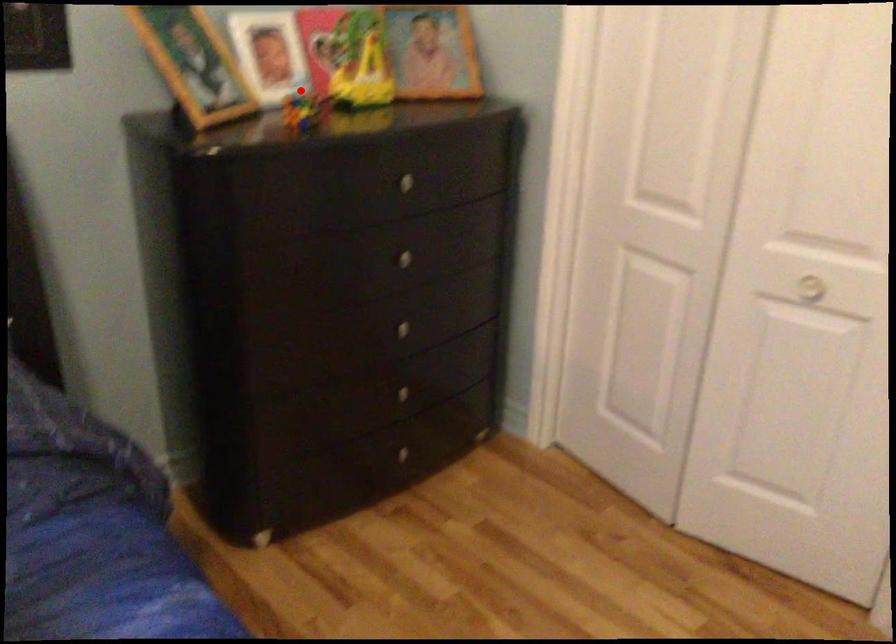
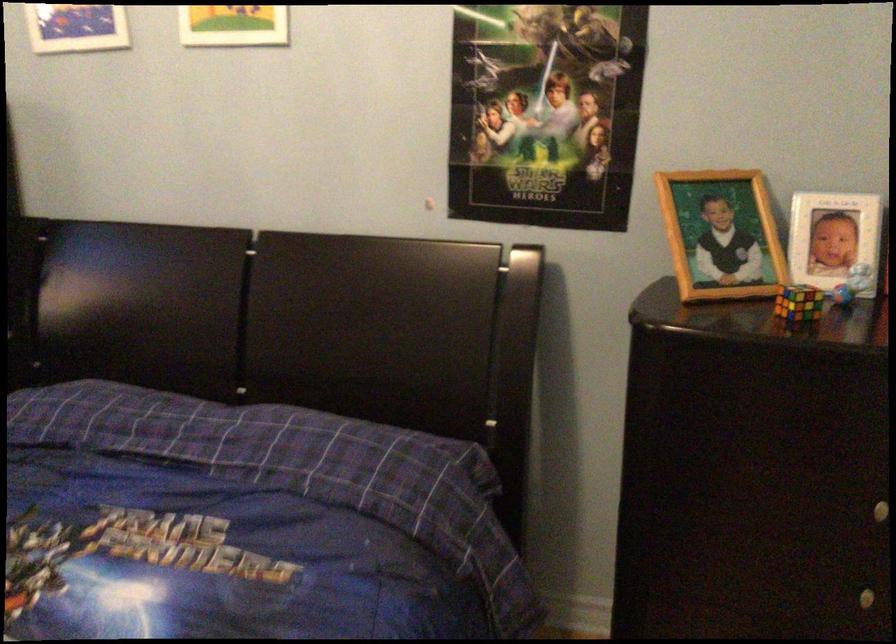
Question: I am providing you with two images of the same scene from different viewpoints. Given a red point in image1, look at the same physical point in image2. Is it:

Choices:
 (A) Closer to the viewpoint
 (B) Farther from the viewpoint

Answer: (A)